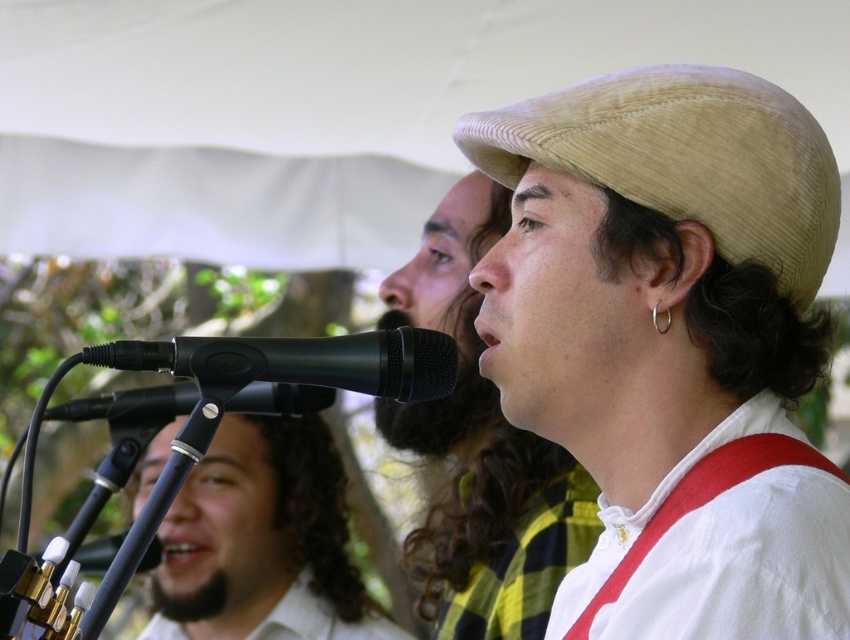
Which is below, beige corduroy cowboy hat at upper right or white matte shirt at lower left?

white matte shirt at lower left is lower down.

Can you confirm if beige corduroy cowboy hat at upper right is positioned below white matte shirt at lower left?

Actually, beige corduroy cowboy hat at upper right is above white matte shirt at lower left.

Find the location of `beige corduroy cowboy hat at upper right`. beige corduroy cowboy hat at upper right is located at coordinates (684, 157).

Can you confirm if matte straw hat at center is wider than beige corduroy cowboy hat at upper right?

Incorrect, matte straw hat at center's width does not surpass beige corduroy cowboy hat at upper right's.

Can you confirm if matte straw hat at center is positioned to the right of beige corduroy cowboy hat at upper right?

Incorrect, matte straw hat at center is not on the right side of beige corduroy cowboy hat at upper right.

Identify the location of matte straw hat at center. The image size is (850, 640). click(479, 451).

Who is higher up, beige corduroy cowboy hat at upper right or red fabric suspenders at center?

beige corduroy cowboy hat at upper right is higher up.

Can you confirm if beige corduroy cowboy hat at upper right is smaller than red fabric suspenders at center?

No.

Is point (499, 164) positioned after point (642, 547)?

Yes.

Where is `beige corduroy cowboy hat at upper right`? beige corduroy cowboy hat at upper right is located at coordinates (x=684, y=157).